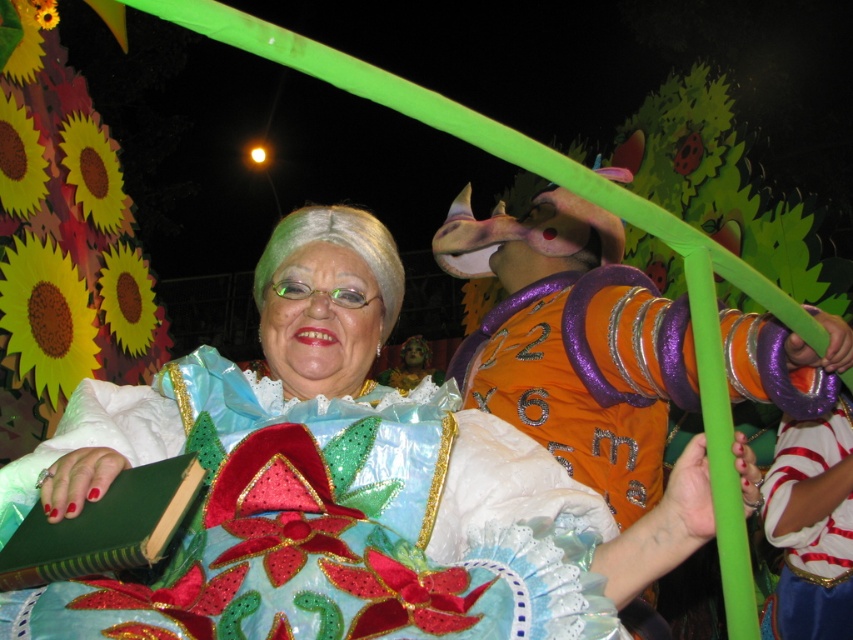
Can you confirm if shiny satin dress at center is positioned below white matte wig at center?

Yes, shiny satin dress at center is below white matte wig at center.

Is shiny satin dress at center positioned before white matte wig at center?

That is True.

Who is more forward, [170,364] or [395,280]?

Point [170,364] is in front.

At what (x,y) coordinates should I click in order to perform the action: click on shiny satin dress at center. Please return your answer as a coordinate pair (x, y). The width and height of the screenshot is (853, 640). Looking at the image, I should click on (326, 518).